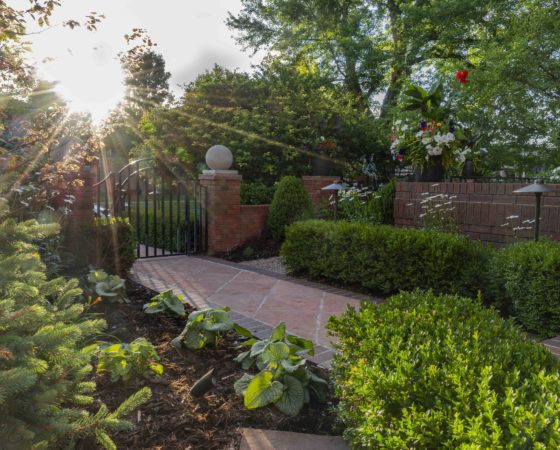
Identify the location of plant. (283, 381).